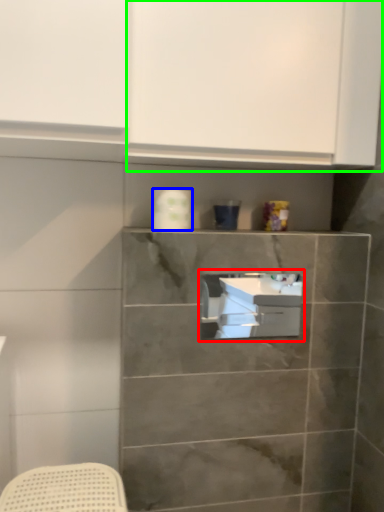
Question: Which object is the closest to the sink (highlighted by a red box)? Choose among these: toilet paper (highlighted by a blue box) or cabinetry (highlighted by a green box).

Choices:
 (A) toilet paper
 (B) cabinetry

Answer: (A)